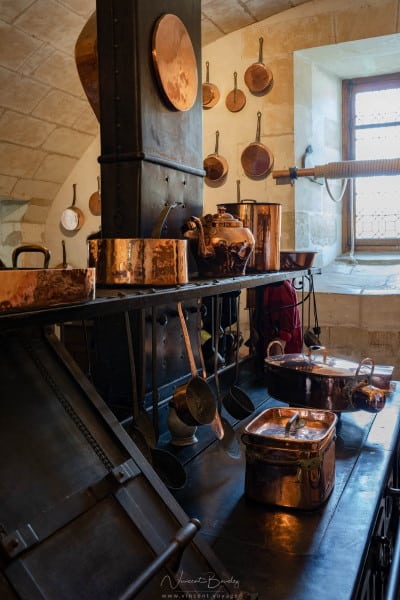
Where is `oven door`? Image resolution: width=400 pixels, height=600 pixels. oven door is located at coordinates (172, 347).